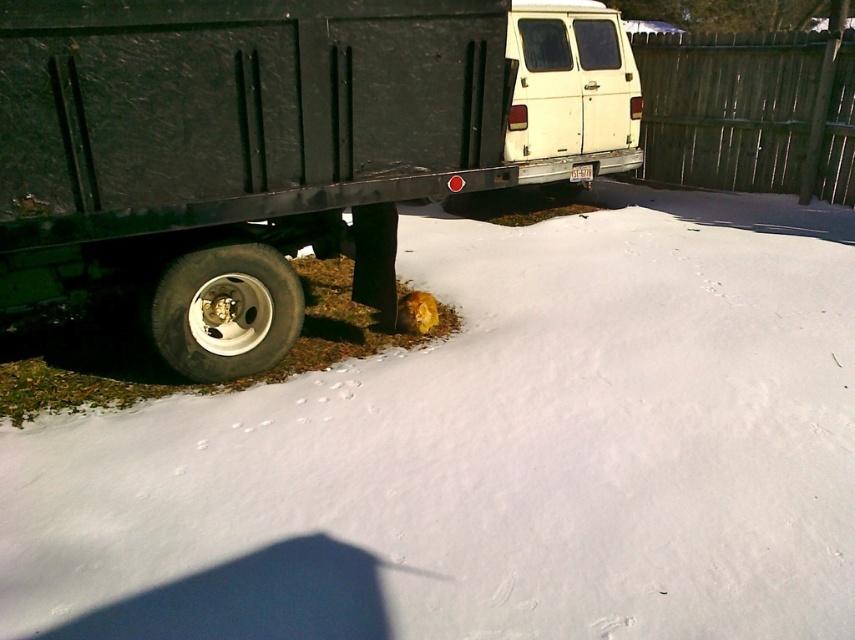
You are trying to determine if the white fluffy snow at lower center can completely cover the wooden fence at upper right if moved. Based on their sizes, is this possible?

The white fluffy snow at lower center is wider than the wooden fence at upper right, so it could potentially cover the fence if moved appropriately.